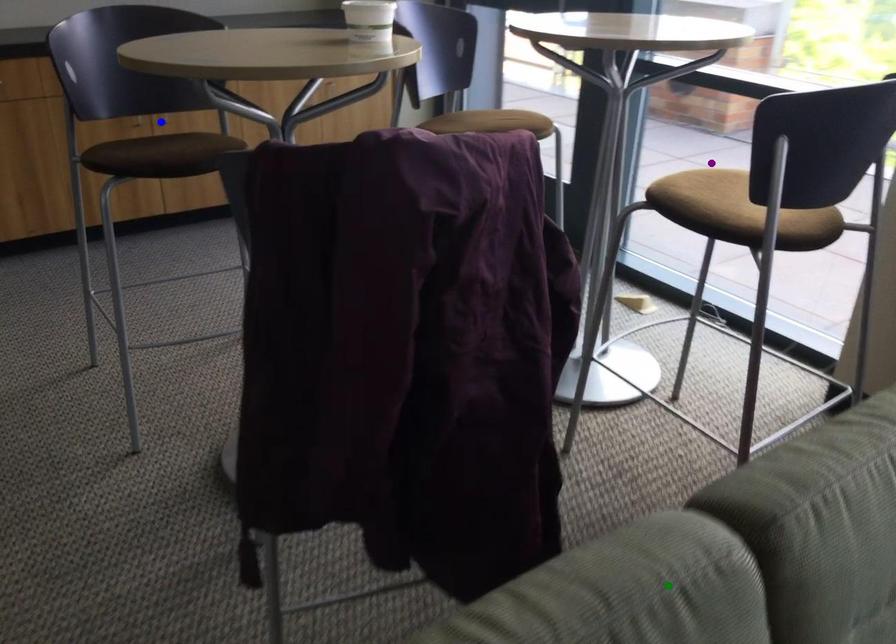
Order these from nearest to farthest:
1. purple point
2. green point
3. blue point

1. green point
2. purple point
3. blue point